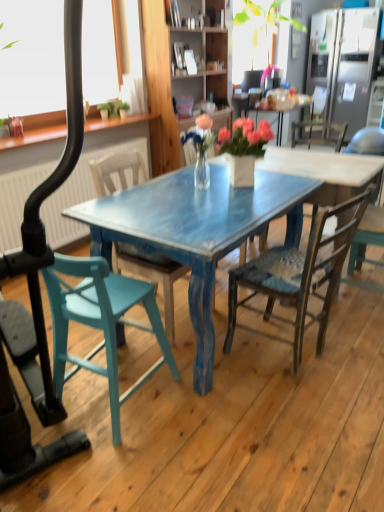
Find the location of a particular element. The height and width of the screenshot is (512, 384). clear glass vase at center is located at coordinates (199, 135).

Image resolution: width=384 pixels, height=512 pixels. What do you see at coordinates (32, 57) in the screenshot? I see `white matte window screen at upper left` at bounding box center [32, 57].

What is the approximate height of wooden chair at right, which appears as the fourth chair when viewed from the left?

wooden chair at right, which appears as the fourth chair when viewed from the left, is 37.39 inches tall.

At what (x,y) coordinates should I click in order to perform the action: click on wooden cabinet at center. Please return your answer as a coordinate pair (x, y). Looking at the image, I should click on (x=203, y=64).

The image size is (384, 512). Describe the element at coordinates (298, 275) in the screenshot. I see `rustic wood chair at center, the third chair positioned from the left` at that location.

Where is `teal painted wood chair at left, which is the fourth chair from right to left`? teal painted wood chair at left, which is the fourth chair from right to left is located at coordinates (100, 322).

Is satin silver refrigerator at upper right turned away from clear glass vase at center?

satin silver refrigerator at upper right is not turned away from clear glass vase at center.

Considering the positions of point (335, 117) and point (204, 127), is point (335, 117) closer or farther from the camera than point (204, 127)?

Clearly, point (335, 117) is more distant from the camera than point (204, 127).

Considering the sizes of objects satin silver refrigerator at upper right and clear glass vase at center in the image provided, who is bigger, satin silver refrigerator at upper right or clear glass vase at center?

satin silver refrigerator at upper right is bigger.

How many degrees apart are the facing directions of rustic wood chair at center, the third chair positioned from the left, and satin silver refrigerator at upper right?

rustic wood chair at center, the third chair positioned from the left, and satin silver refrigerator at upper right are facing 101 degrees away from each other.

Is rustic wood chair at center, the third chair positioned from the left, aimed at satin silver refrigerator at upper right?

No, rustic wood chair at center, the third chair positioned from the left, is not turned towards satin silver refrigerator at upper right.

Between rustic wood chair at center, the third chair positioned from the left, and satin silver refrigerator at upper right, which one has smaller size?

Smaller between the two is rustic wood chair at center, the third chair positioned from the left.

From the image's perspective, is rustic wood chair at center, the third chair positioned from the left, on top of satin silver refrigerator at upper right?

Incorrect, from the image's perspective, rustic wood chair at center, the third chair positioned from the left, is lower than satin silver refrigerator at upper right.

Locate an element on the screen. the 3rd chair positioned below the clear glass vase at center (from a real-world perspective) is located at coordinates (151, 274).

Which of these two, clear glass vase at center or teal painted wood chair at center, positioned as the second chair in left-to-right order, is thinner?

clear glass vase at center is thinner.

Would you say clear glass vase at center is outside teal painted wood chair at center, positioned as the second chair in left-to-right order?

Actually, clear glass vase at center is within teal painted wood chair at center, positioned as the second chair in left-to-right order.

From their relative heights in the image, would you say clear glass vase at center is taller or shorter than teal painted wood chair at center, positioned as the second chair in left-to-right order?

Clearly, clear glass vase at center is shorter compared to teal painted wood chair at center, positioned as the second chair in left-to-right order.

Is wooden cabinet at center located outside clear glass vase at center?

Yes, wooden cabinet at center is located beyond the bounds of clear glass vase at center.

From a real-world perspective, is wooden cabinet at center below clear glass vase at center?

No, from a real-world perspective, wooden cabinet at center is not under clear glass vase at center.

Would you say wooden cabinet at center is to the left or to the right of clear glass vase at center in the picture?

Based on their positions, wooden cabinet at center is located to the left of clear glass vase at center.

The height and width of the screenshot is (512, 384). I want to click on flower that is in front of the wooden cabinet at center, so click(x=199, y=135).

Who is smaller, rustic wood chair at center, the third chair positioned from the left, or white matte window screen at upper left?

rustic wood chair at center, the third chair positioned from the left, is smaller.

From the image's perspective, does rustic wood chair at center, the third chair positioned from the left, appear lower than white matte window screen at upper left?

Indeed, from the image's perspective, rustic wood chair at center, the third chair positioned from the left, is shown beneath white matte window screen at upper left.

Would you say rustic wood chair at center, which is the 2th chair from right to left, is inside or outside white matte window screen at upper left?

rustic wood chair at center, which is the 2th chair from right to left, lies outside white matte window screen at upper left.

Identify the location of window screen above the rustic wood chair at center, the third chair positioned from the left (from a real-world perspective). (32, 57).

Is wooden chair at right, which appears as the fourth chair when viewed from the left, at the right side of white matte window screen at upper left?

Yes.

From the image's perspective, is wooden chair at right, the first chair positioned from the right, positioned above or below white matte window screen at upper left?

Clearly, from the image's perspective, wooden chair at right, the first chair positioned from the right, is below white matte window screen at upper left.

Does point (381, 151) come in front of point (93, 100)?

Yes, point (381, 151) is closer to viewer.

Between wooden chair at right, the first chair positioned from the right, and white matte window screen at upper left, which one is positioned behind?

white matte window screen at upper left is behind.

Is wooden chair at right, which appears as the fourth chair when viewed from the left, positioned before teal painted wood chair at left, which appears as the first chair when viewed from the left?

No, it is not.

Which is nearer, (381, 133) or (77, 263)?

The point (77, 263) is closer.

From a real-world perspective, which object rests below the other?

From a 3D spatial view, teal painted wood chair at left, which is the fourth chair from right to left, is below.

You are a GUI agent. You are given a task and a screenshot of the screen. Output one action in this format:
    pyautogui.click(x=<x>, y=<y>)
    Task: Click on the refrigerator to the right of clear glass vase at center
    Image resolution: width=384 pixels, height=512 pixels.
    Given the screenshot: What is the action you would take?
    pyautogui.click(x=344, y=62)

This screenshot has width=384, height=512. Identify the location of refrigerator above the rustic wood chair at center, the third chair positioned from the left (from a real-world perspective). (344, 62).

When comparing their distances from white matte window screen at upper left, does teal painted wood chair at left, which appears as the first chair when viewed from the left, or satin silver refrigerator at upper right seem further?

satin silver refrigerator at upper right.

From the image, which object appears to be nearer to white matte window screen at upper left, satin silver refrigerator at upper right or wooden chair at right, which appears as the fourth chair when viewed from the left?

wooden chair at right, which appears as the fourth chair when viewed from the left, is closer to white matte window screen at upper left.

Based on their spatial positions, is wooden chair at right, the first chair positioned from the right, or clear glass vase at center further from rustic wood chair at center, the third chair positioned from the left?

Among the two, wooden chair at right, the first chair positioned from the right, is located further to rustic wood chair at center, the third chair positioned from the left.

Considering their positions, is wooden cabinet at center positioned further to wooden chair at right, the first chair positioned from the right, than teal painted wood chair at center, the third chair positioned from the right?

teal painted wood chair at center, the third chair positioned from the right.

Based on their spatial positions, is white matte window screen at upper left or wooden chair at right, the first chair positioned from the right, closer to teal painted wood chair at left, which appears as the first chair when viewed from the left?

Based on the image, white matte window screen at upper left appears to be nearer to teal painted wood chair at left, which appears as the first chair when viewed from the left.

From the image, which object appears to be nearer to satin silver refrigerator at upper right, wooden cabinet at center or teal painted wood chair at center, positioned as the second chair in left-to-right order?

Based on the image, wooden cabinet at center appears to be nearer to satin silver refrigerator at upper right.

Considering their positions, is teal painted wood chair at center, positioned as the second chair in left-to-right order, positioned further to teal painted wood chair at left, which is the fourth chair from right to left, than wooden cabinet at center?

wooden cabinet at center is further to teal painted wood chair at left, which is the fourth chair from right to left.

Based on their spatial positions, is rustic wood chair at center, the third chair positioned from the left, or teal painted wood chair at center, positioned as the second chair in left-to-right order, closer to satin silver refrigerator at upper right?

rustic wood chair at center, the third chair positioned from the left, is positioned closer to the anchor satin silver refrigerator at upper right.

The height and width of the screenshot is (512, 384). I want to click on window screen between wooden chair at right, which appears as the fourth chair when viewed from the left, and satin silver refrigerator at upper right in the front-back direction, so click(32, 57).

Where is `cabinetry between teal painted wood chair at center, the third chair positioned from the right, and satin silver refrigerator at upper right in the front-back direction`? Image resolution: width=384 pixels, height=512 pixels. cabinetry between teal painted wood chair at center, the third chair positioned from the right, and satin silver refrigerator at upper right in the front-back direction is located at coordinates (203, 64).

What are the coordinates of `cabinetry between clear glass vase at center and satin silver refrigerator at upper right from front to back` in the screenshot? It's located at (203, 64).

Identify the location of chair between wooden cabinet at center and teal painted wood chair at center, the third chair positioned from the right, vertically. (367, 142).